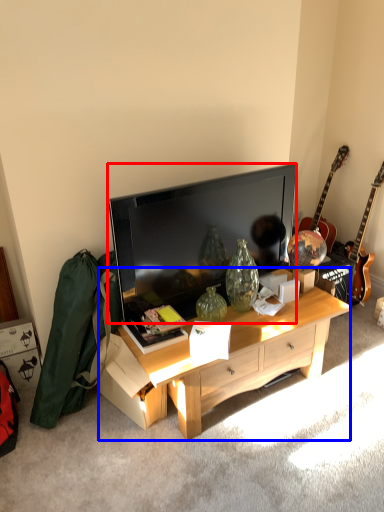
Question: Among these objects, which one is nearest to the camera, television (highlighted by a red box) or desk (highlighted by a blue box)?

Choices:
 (A) television
 (B) desk

Answer: (B)